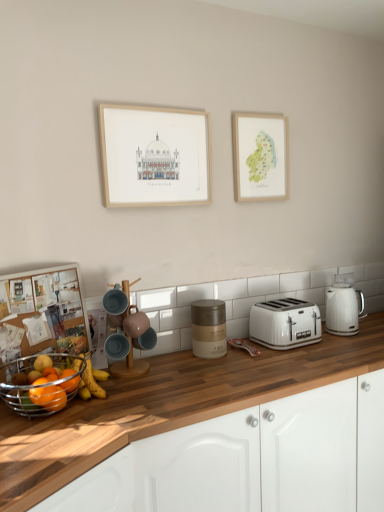
This screenshot has height=512, width=384. What are the coordinates of `free spot above white wood cabinetry at center (from a real-world perspective)` in the screenshot? It's located at click(x=249, y=364).